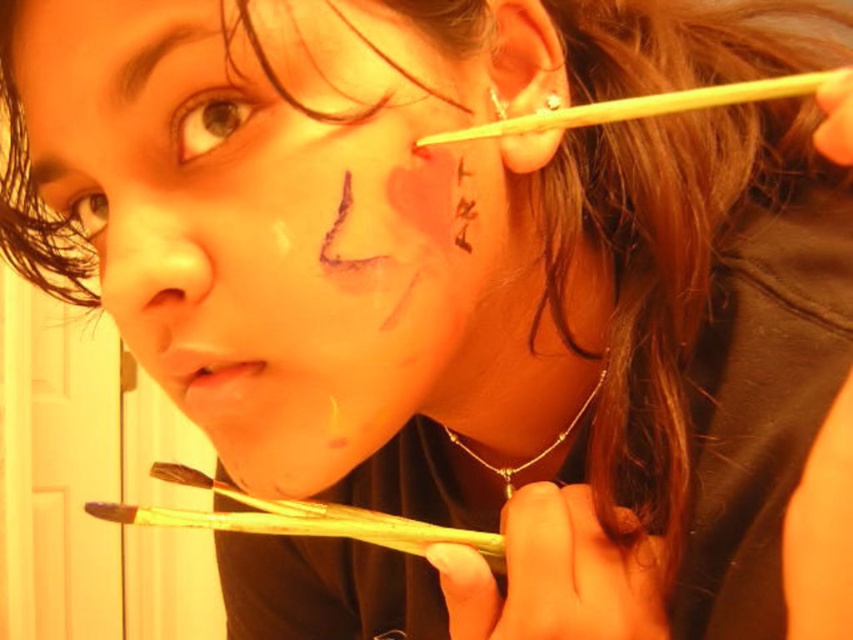
Is point (666, 100) closer to camera compared to point (61, 166)?

Yes.

Who is higher up, yellow wood chopstick at ear or brown matte eyebrow at upper left?

yellow wood chopstick at ear is higher up.

Between point (793, 84) and point (28, 168), which one is positioned in front?

Point (793, 84) is in front.

I want to click on yellow wood chopstick at ear, so 641,106.

Can you confirm if matte black paint at center is thinner than matte flesh-colored nose at center?

No, matte black paint at center is not thinner than matte flesh-colored nose at center.

Does matte black paint at center have a greater width compared to matte flesh-colored nose at center?

Indeed, matte black paint at center has a greater width compared to matte flesh-colored nose at center.

Is point (132, 227) less distant than point (175, 253)?

That is False.

I want to click on matte black paint at center, so click(x=281, y=220).

In the scene shown: Can you confirm if matte black paint at center is shorter than brown matte eyebrow at upper left?

No.

Does matte black paint at center appear on the right side of brown matte eyebrow at upper left?

Indeed, matte black paint at center is positioned on the right side of brown matte eyebrow at upper left.

Who is more forward, (22, 74) or (61, 172)?

Positioned in front is point (22, 74).

The height and width of the screenshot is (640, 853). In order to click on matte black paint at center in this screenshot , I will do `click(281, 220)`.